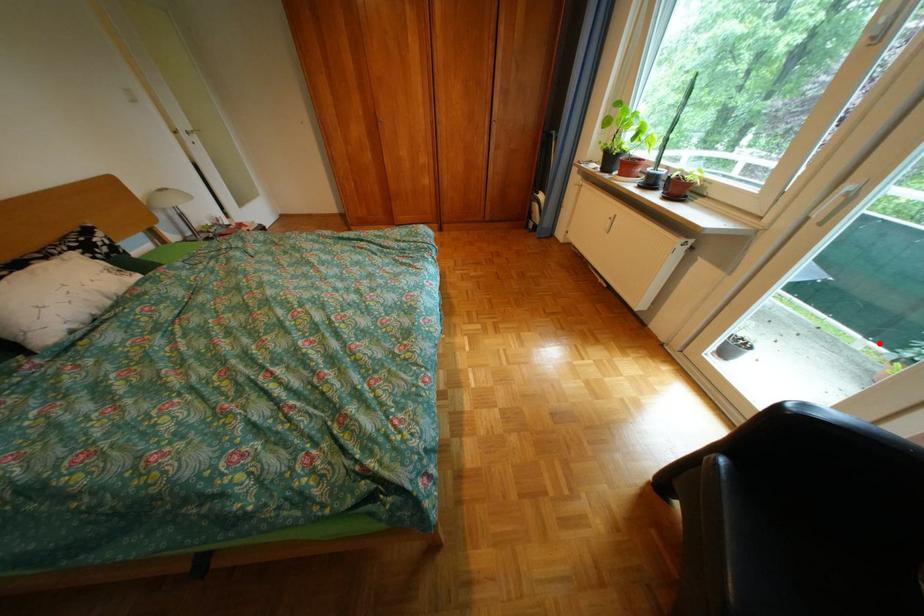
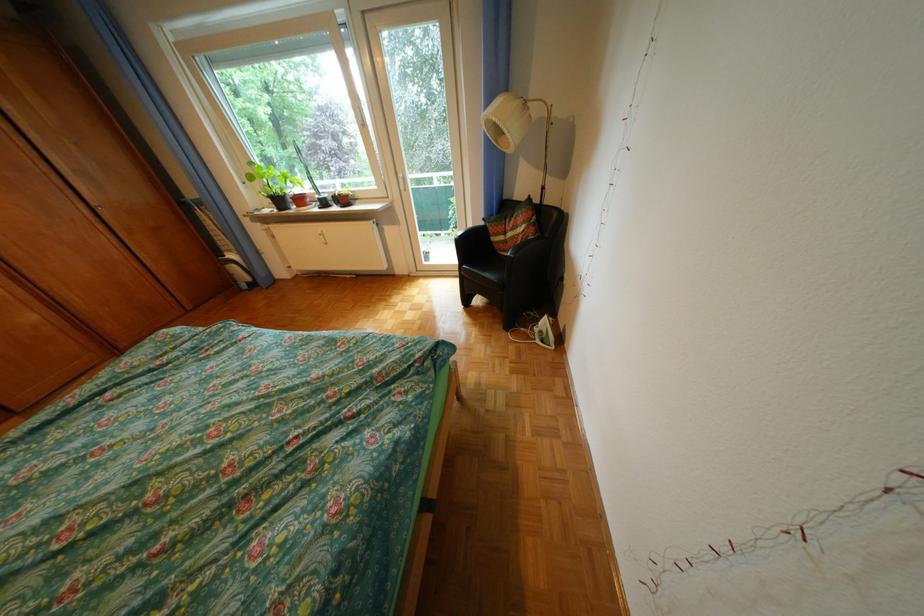
Locate, in the second image, the point that corresponds to the highlighted location in the first image.

(457, 233)